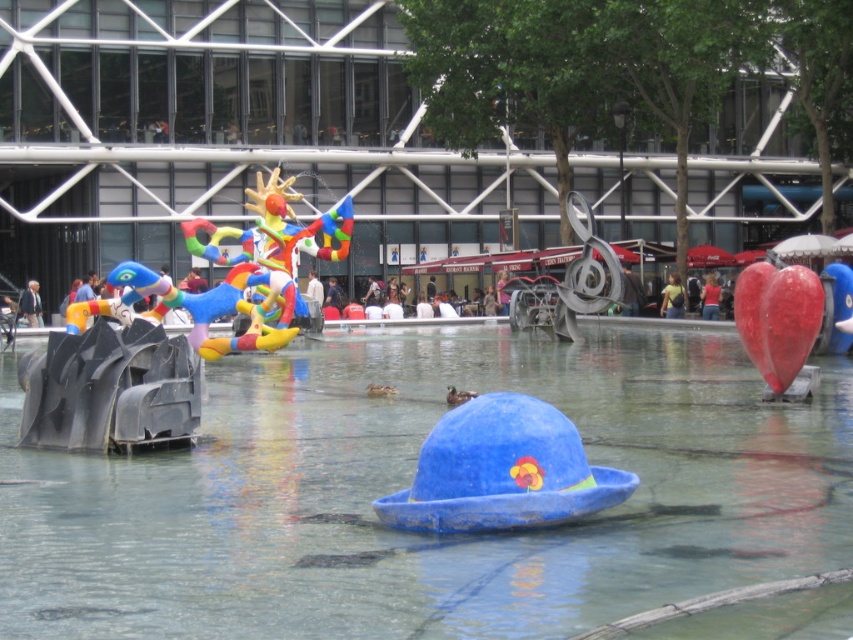
Question: Which object appears farthest from the camera in this image?

Choices:
 (A) transparent plastic water at center
 (B) shiny red heart at right
 (C) blue felt hat at center
 (D) rubber heart at right

Answer: (D)

Question: Which of these objects is positioned farthest from the rubber heart at right?

Choices:
 (A) transparent plastic water at center
 (B) blue felt hat at center

Answer: (B)

Question: Can you confirm if transparent plastic water at center is smaller than shiny red heart at right?

Choices:
 (A) no
 (B) yes

Answer: (A)

Question: Which point appears closest to the camera in this image?

Choices:
 (A) (534, 460)
 (B) (247, 531)
 (C) (756, 324)

Answer: (A)

Question: Can you confirm if transparent plastic water at center is wider than blue felt hat at center?

Choices:
 (A) no
 (B) yes

Answer: (B)

Question: Is blue felt hat at center further to the viewer compared to shiny red heart at right?

Choices:
 (A) no
 (B) yes

Answer: (A)